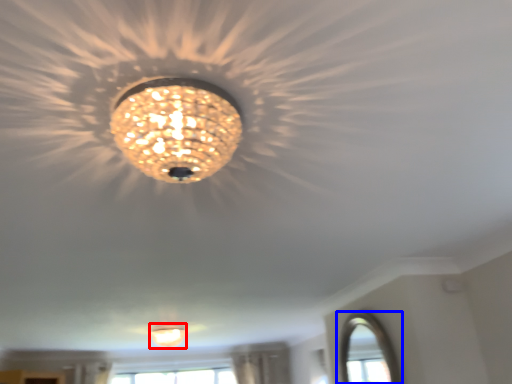
Question: Which point is closer to the camera, lamp (highlighted by a red box) or window (highlighted by a blue box)?

Choices:
 (A) lamp
 (B) window

Answer: (B)